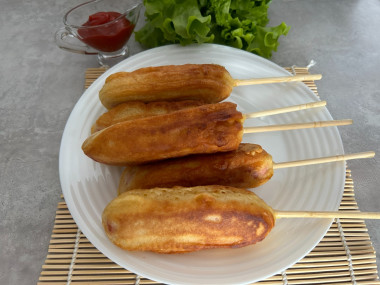
Identify the location of cup handle. The height and width of the screenshot is (285, 380). (71, 47).